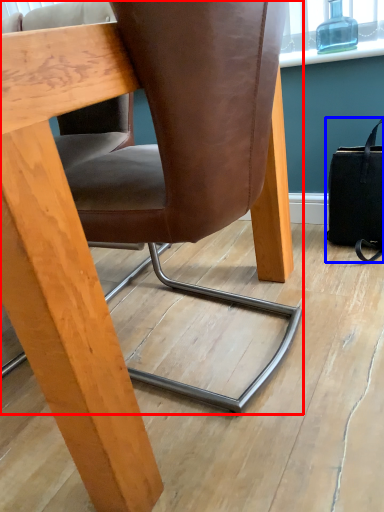
Question: Which object is closer to the camera taking this photo, chair (highlighted by a red box) or handbag (highlighted by a blue box)?

Choices:
 (A) chair
 (B) handbag

Answer: (A)